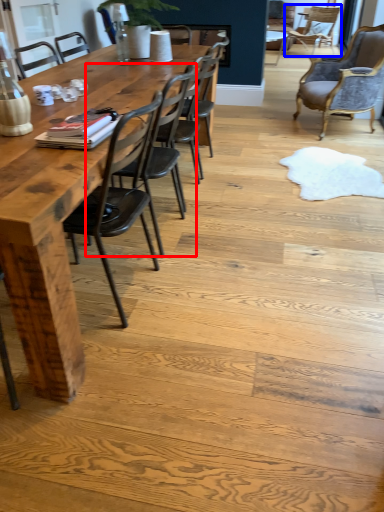
Question: Among these objects, which one is nearest to the camera, chair (highlighted by a red box) or chair (highlighted by a blue box)?

Choices:
 (A) chair
 (B) chair

Answer: (A)